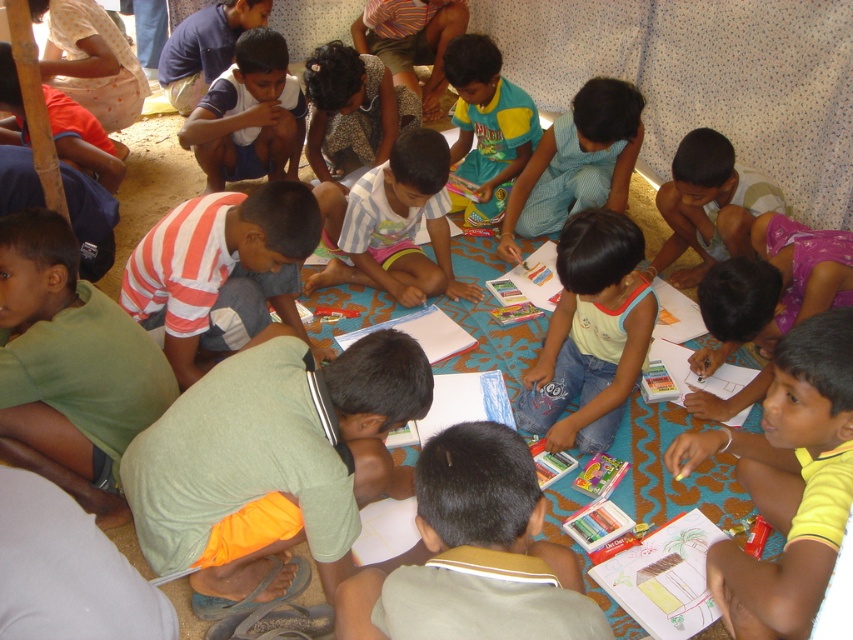
You are a teacher who needs to hand out a new coloring book to both the green fabric shirt at lower left and the striped fabric shirt at center. The coloring book is 1.2 meters long. Can you place the coloring book between them so that both children can reach it easily?

The distance between the green fabric shirt at lower left and the striped fabric shirt at center is 1.19 meters. Since the coloring book is 1.2 meters long, it would be slightly too long to fit between them comfortably. You might need to adjust their positions or choose a shorter coloring book.

You are a teacher observing the children in the art activity. You notice two children wearing the green matte shirt at left and the white cotton shirt at center. Which child is wearing a narrower shirt?

The green matte shirt at left has a lesser width compared to the white cotton shirt at center, so the child wearing the green matte shirt at left has a narrower shirt.

You are a teacher organizing an art activity. You have two shirts to place on a small shelf. The green fabric shirt at lower left and the striped fabric shirt at center. Which shirt will require more space on the shelf?

The green fabric shirt at lower left requires more space on the shelf because its width is larger than the striped fabric shirt at center.